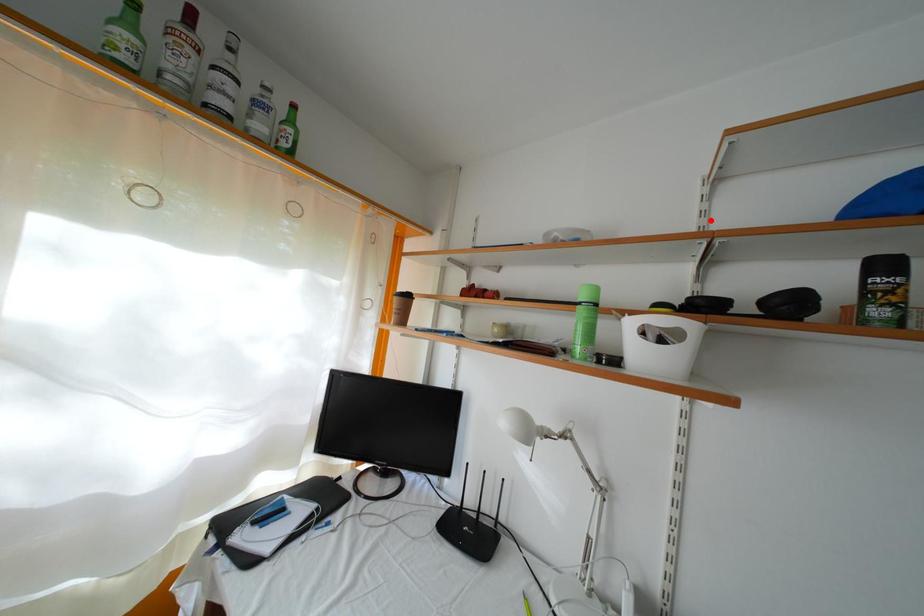
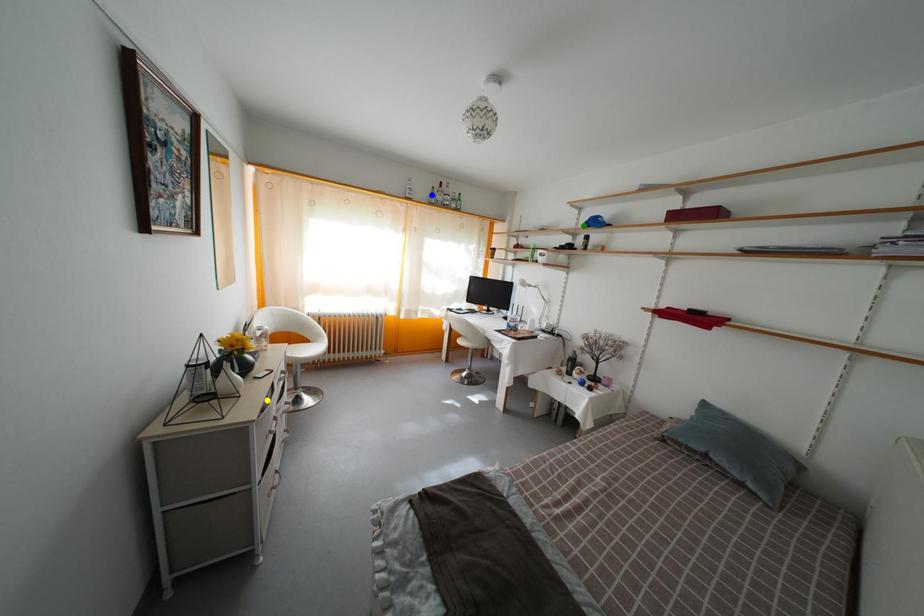
Question: I am providing you with two images of the same scene from different viewpoints. A red point is marked on the first image. You are given multiple points on the second image. Which point in image 2 represents the same 3d spot as the red point in image 1?

Choices:
 (A) yellow point
 (B) blue point
 (C) green point

Answer: (C)